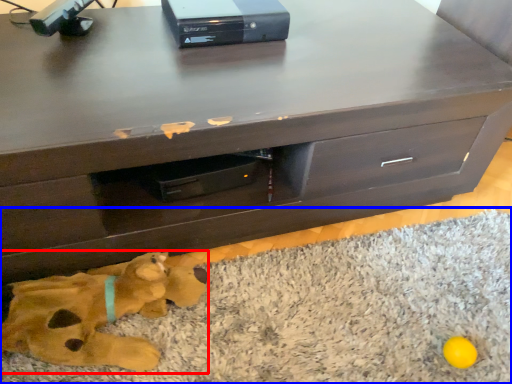
Question: Among these objects, which one is nearest to the camera, animal (highlighted by a red box) or mat (highlighted by a blue box)?

Choices:
 (A) animal
 (B) mat

Answer: (B)